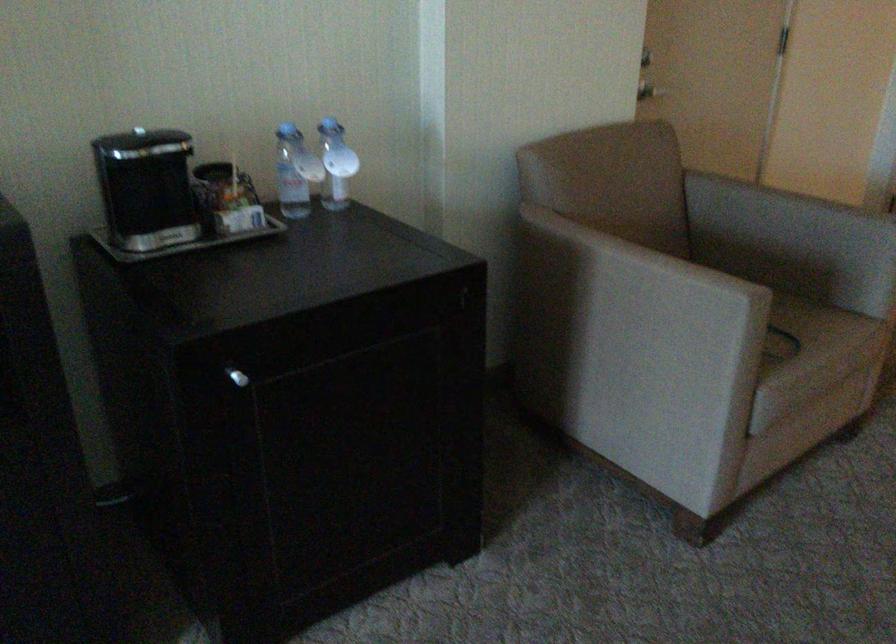
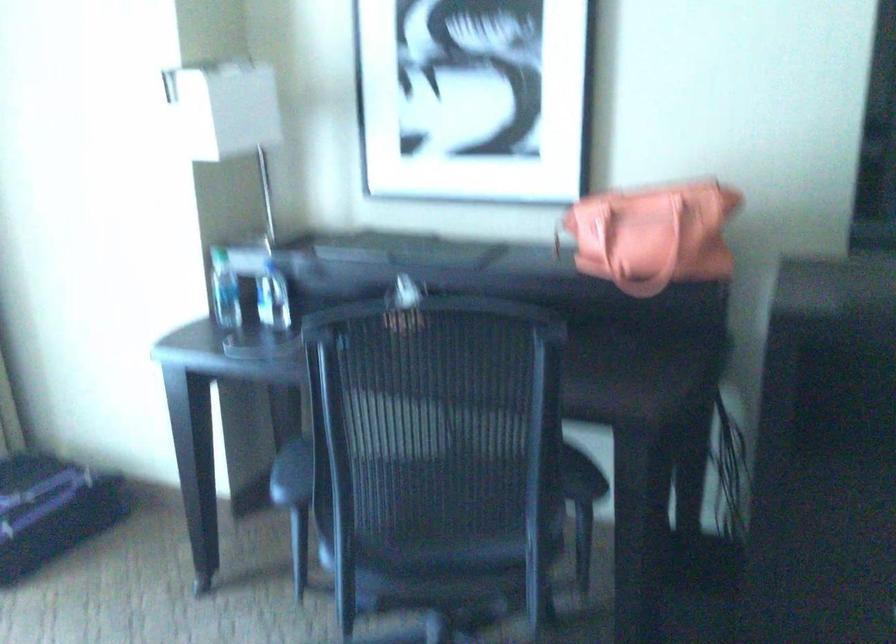
Question: The camera is either moving clockwise (left) or counter-clockwise (right) around the object. The first image is from the beginning of the video and the second image is from the end. Is the camera moving left or right when shooting the video?

Choices:
 (A) Left
 (B) Right

Answer: (B)